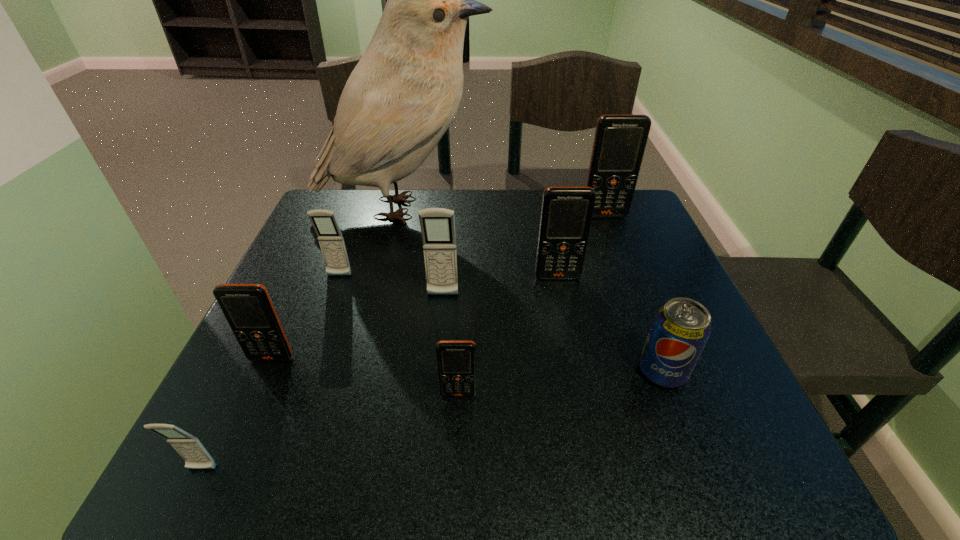
The width and height of the screenshot is (960, 540). I want to click on vacant space situated 0.260m on the screen of the second biggest orange cellular telephone, so click(x=578, y=378).

This screenshot has width=960, height=540. Find the location of `free point located 0.360m on the front-facing side of the third cellular telephone from left to right`. free point located 0.360m on the front-facing side of the third cellular telephone from left to right is located at coordinates (283, 428).

Where is `vacant space positioned on the screen of the second nearest orange cellular telephone`? vacant space positioned on the screen of the second nearest orange cellular telephone is located at coordinates (243, 422).

Identify the location of vacant space located 0.280m on the left of the soda. tap(482, 372).

Find the location of `vacant space located on the screen of the third orange cellular telephone from right to left`. vacant space located on the screen of the third orange cellular telephone from right to left is located at coordinates (457, 443).

This screenshot has height=540, width=960. Identify the location of parakeet that is at the far edge. (403, 94).

At what (x,y) coordinates should I click in order to perform the action: click on cellular telephone at the far edge. Please return your answer as a coordinate pair (x, y). Looking at the image, I should click on (620, 140).

Where is `object located at the near edge`? This screenshot has width=960, height=540. object located at the near edge is located at coordinates (189, 447).

Identify the location of parakeet located in the left edge section of the desktop. This screenshot has height=540, width=960. (403, 94).

Identify the location of cellular telephone present at the right edge. This screenshot has height=540, width=960. (620, 140).